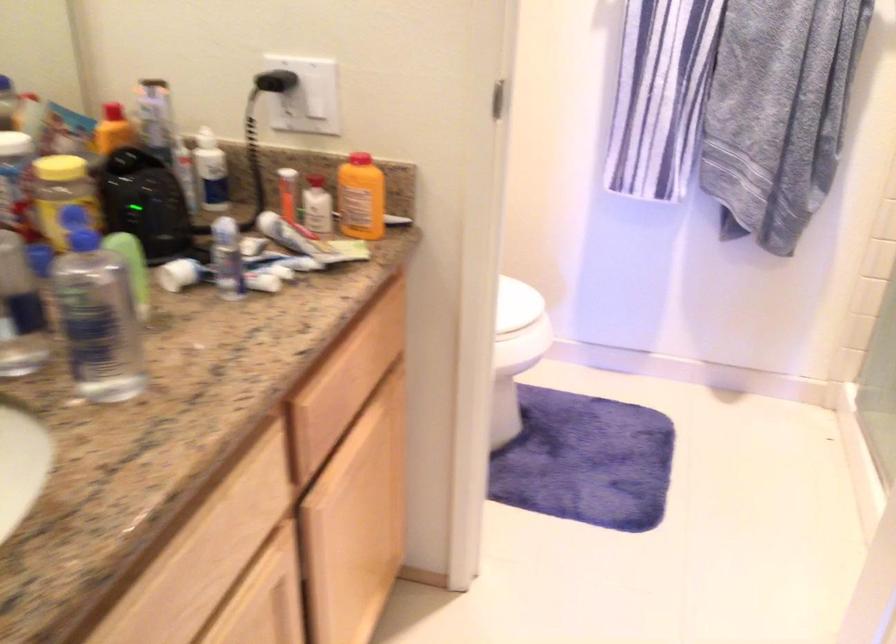
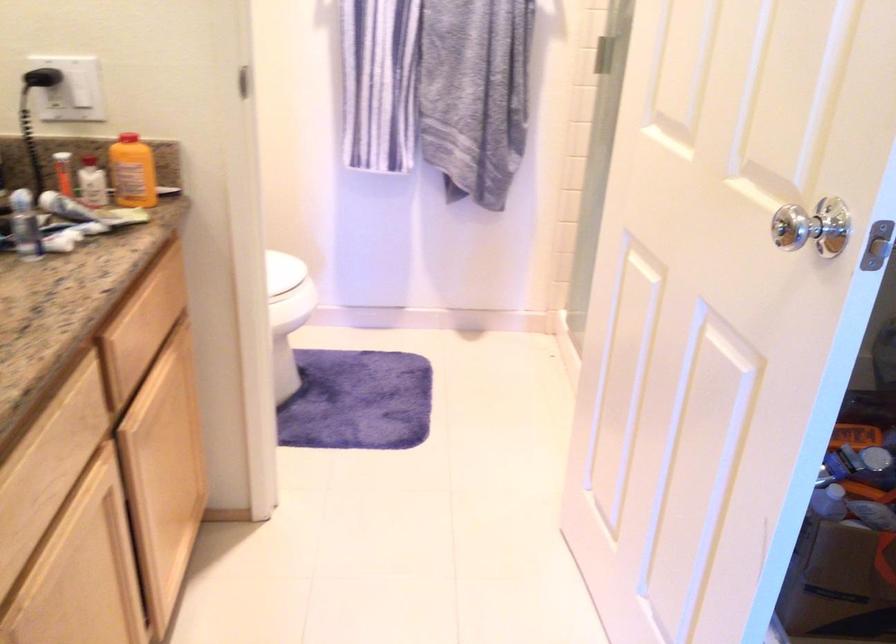
Question: The camera is either moving clockwise (left) or counter-clockwise (right) around the object. The first image is from the beginning of the video and the second image is from the end. Is the camera moving left or right when shooting the video?

Choices:
 (A) Left
 (B) Right

Answer: (A)